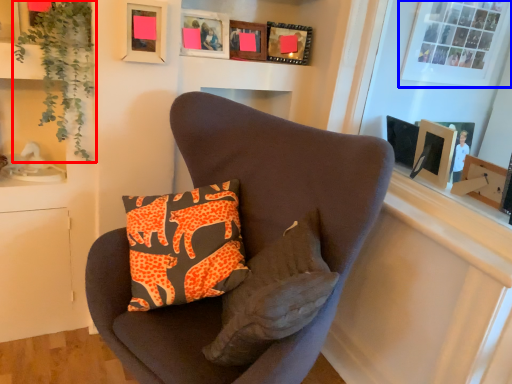
Question: Among these objects, which one is farthest to the camera, plant (highlighted by a red box) or bay window (highlighted by a blue box)?

Choices:
 (A) plant
 (B) bay window

Answer: (B)